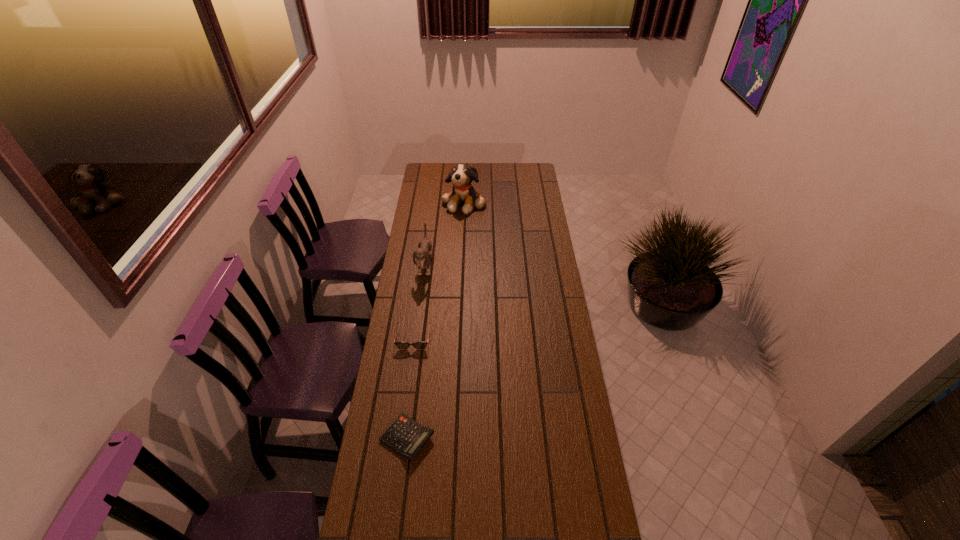
Find the location of a particular element. The image size is (960, 540). object that is the third nearest to the nearest object is located at coordinates (461, 176).

What are the coordinates of `blank area in the image that satisfies the following two spatial constraints: 1. at the front view of the calculator; 2. on the right side of the second shortest object` in the screenshot? It's located at (400, 438).

Locate an element on the screen. The image size is (960, 540). free spot that satisfies the following two spatial constraints: 1. at the face of the nearer puppy; 2. on the left side of the nearest object is located at coordinates (402, 438).

Locate an element on the screen. The height and width of the screenshot is (540, 960). vacant space that satisfies the following two spatial constraints: 1. at the face of the calculator; 2. on the right side of the left puppy is located at coordinates (402, 438).

I want to click on free point that satisfies the following two spatial constraints: 1. at the face of the nearer puppy; 2. at the front view of the second shortest object, so click(x=416, y=338).

The image size is (960, 540). I want to click on free location that satisfies the following two spatial constraints: 1. at the face of the taller puppy; 2. at the face of the second tallest object, so click(x=461, y=266).

Where is `vacant space that satisfies the following two spatial constraints: 1. at the front view of the nearest object; 2. on the left side of the spectacles`? The height and width of the screenshot is (540, 960). vacant space that satisfies the following two spatial constraints: 1. at the front view of the nearest object; 2. on the left side of the spectacles is located at coordinates (400, 438).

Identify the location of free spot that satisfies the following two spatial constraints: 1. at the front view of the calculator; 2. on the left side of the spectacles. (400, 438).

Identify the location of free location that satisfies the following two spatial constraints: 1. at the face of the taller puppy; 2. at the face of the shorter puppy. (461, 266).